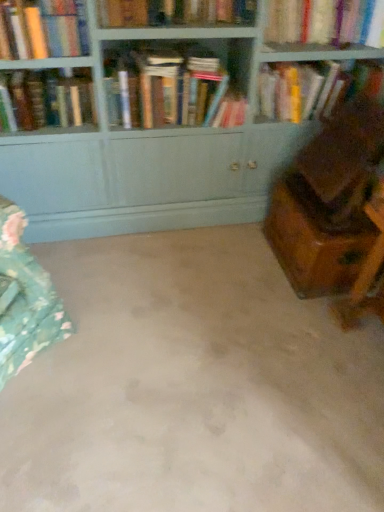
Question: Does point (185, 113) appear closer or farther from the camera than point (74, 181)?

Choices:
 (A) closer
 (B) farther

Answer: (A)

Question: Relative to matte wood bookcase at upper center, is hardcover books at center, positioned as the 3th book in left-to-right order, in front or behind?

Choices:
 (A) front
 (B) behind

Answer: (B)

Question: Which object is the closest to the hardcover book at upper center, the third book from the right?

Choices:
 (A) beige carpet at center
 (B) hardcover books at center, marked as the 4th book in a right-to-left arrangement
 (C) hardcover book at upper center, which is the second book in right-to-left order
 (D) hardcover book at upper right, the 6th book viewed from the left
 (E) hardcover book at upper left, which is the second book from left to right

Answer: (E)

Question: Which object is the farthest from the beige carpet at center?

Choices:
 (A) hardcover book at upper left, which is the second book from left to right
 (B) matte wood bookcase at upper center
 (C) hardcover book at upper left, which appears as the 6th book when viewed from the right
 (D) hardcover books at center, positioned as the 3th book in left-to-right order
 (E) hardcover book at upper center, acting as the 5th book starting from the left

Answer: (E)